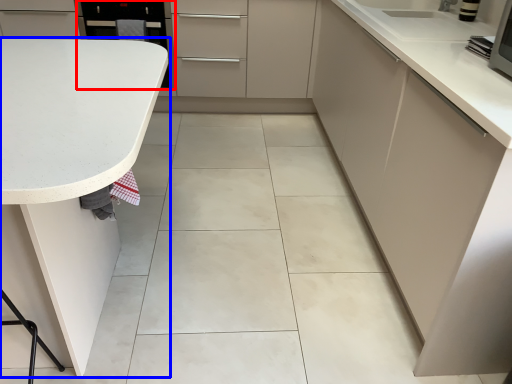
Question: Which point is closer to the camera, appliance (highlighted by a red box) or countertop (highlighted by a blue box)?

Choices:
 (A) appliance
 (B) countertop

Answer: (B)